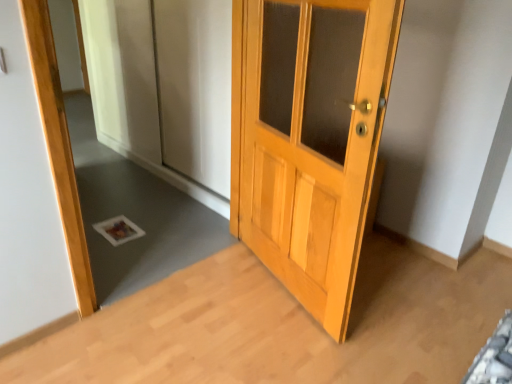
Question: Would you say white glossy mirror at lower left is to the left or to the right of light brown wooden door at center in the picture?

Choices:
 (A) right
 (B) left

Answer: (B)

Question: Relative to light brown wooden door at center, is white glossy mirror at lower left in front or behind?

Choices:
 (A) behind
 (B) front

Answer: (A)

Question: Looking at the image, does white glossy mirror at lower left seem bigger or smaller compared to light brown wooden door at center?

Choices:
 (A) big
 (B) small

Answer: (B)

Question: Is point (262, 218) positioned closer to the camera than point (96, 165)?

Choices:
 (A) farther
 (B) closer

Answer: (B)

Question: From a real-world perspective, is light brown wooden door at center positioned above or below white glossy mirror at lower left?

Choices:
 (A) below
 (B) above

Answer: (B)

Question: From the image's perspective, relative to white glossy mirror at lower left, is light brown wooden door at center above or below?

Choices:
 (A) below
 (B) above

Answer: (A)

Question: Considering the relative positions of light brown wooden door at center and white glossy mirror at lower left in the image provided, is light brown wooden door at center to the left or to the right of white glossy mirror at lower left?

Choices:
 (A) left
 (B) right

Answer: (B)